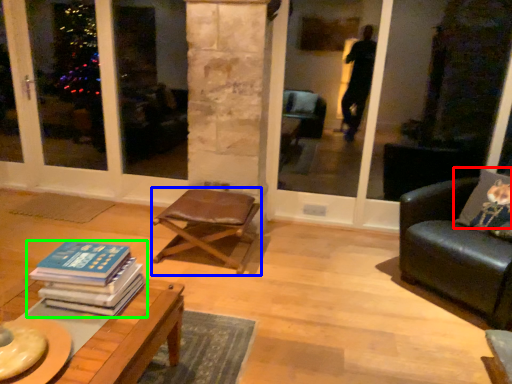
Question: Which object is positioned closest to pillow (highlighted by a red box)? Select from chair (highlighted by a blue box) and book (highlighted by a green box).

Choices:
 (A) chair
 (B) book

Answer: (A)